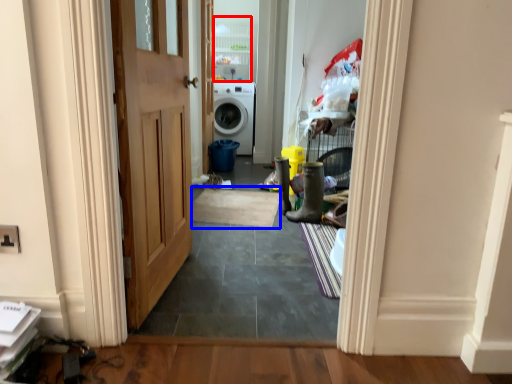
Question: Which object appears closest to the camera in this image, cabinetry (highlighted by a red box) or doormat (highlighted by a blue box)?

Choices:
 (A) cabinetry
 (B) doormat

Answer: (B)